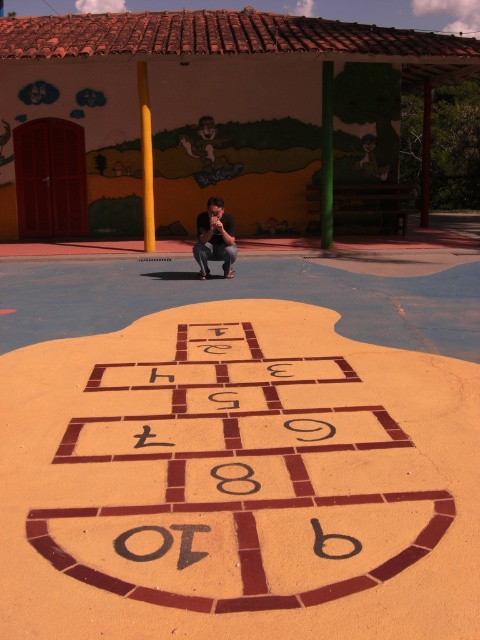
Describe the element at coordinates (235, 483) in the screenshot. I see `brown tile hopscotch at center` at that location.

Is brown tile hopscotch at center closer to camera compared to matte black shirt at center?

Yes, it is.

Is point (265, 412) positioned before point (214, 224)?

That is True.

The height and width of the screenshot is (640, 480). Identify the location of brown tile hopscotch at center. (235, 483).